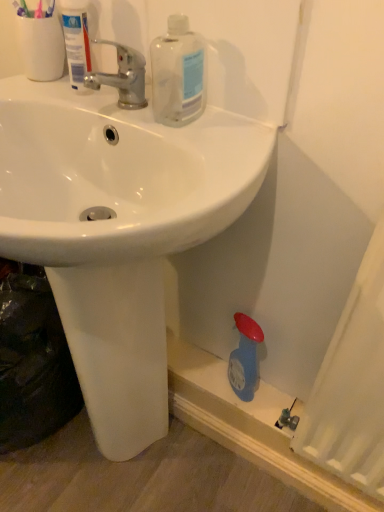
The image size is (384, 512). Find the location of `vacant space that is to the left of transparent plastic bottle at upper center`. vacant space that is to the left of transparent plastic bottle at upper center is located at coordinates (98, 104).